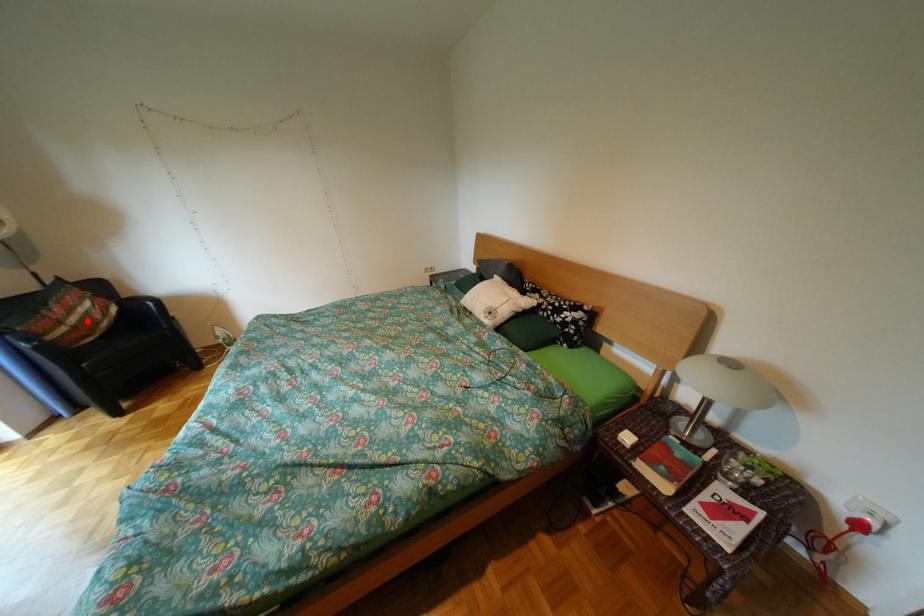
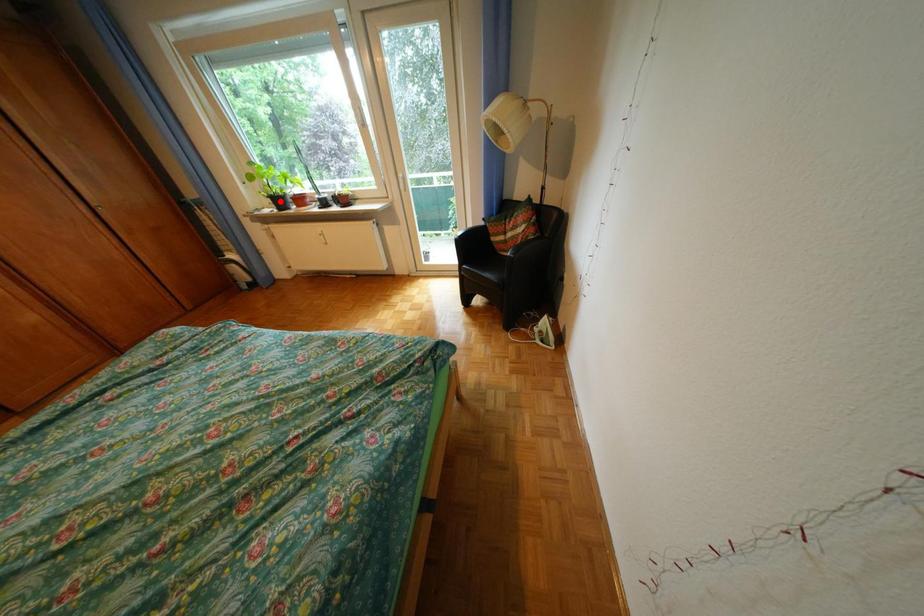
I am providing you with two images of the same scene from different viewpoints. A red point is marked on the first image and another point is marked on the second image. Is the red point in image1 aligned with the point shown in image2?

No